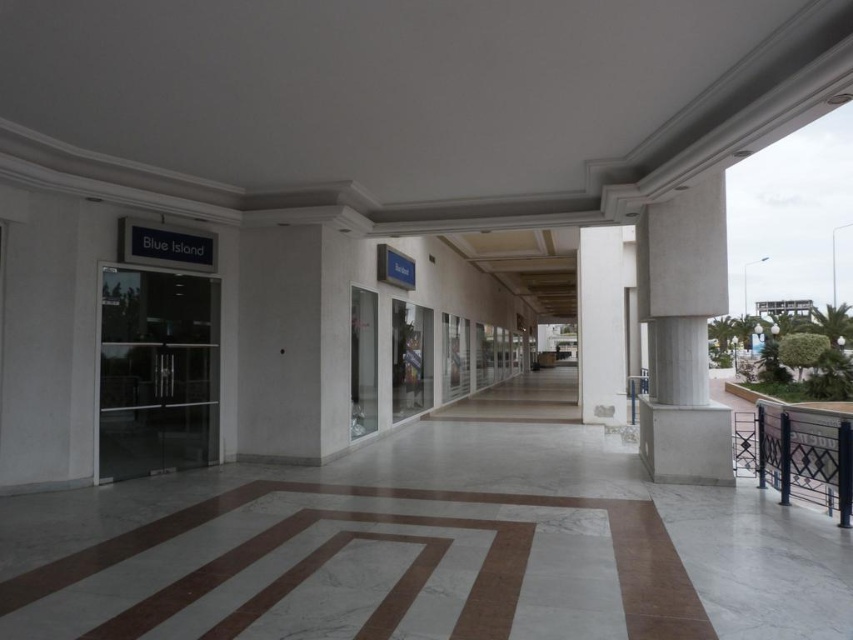
Who is more distant from viewer, (595, 376) or (776, 467)?

The point (595, 376) is more distant.

This screenshot has width=853, height=640. What do you see at coordinates (602, 323) in the screenshot?
I see `white marble pillar at center` at bounding box center [602, 323].

Locate an element on the screen. This screenshot has width=853, height=640. white marble pillar at center is located at coordinates 602,323.

Who is positioned more to the right, white marble pillar at right or white marble pillar at center?

white marble pillar at center

Is the position of white marble pillar at right less distant than that of white marble pillar at center?

Yes, white marble pillar at right is in front of white marble pillar at center.

The width and height of the screenshot is (853, 640). What do you see at coordinates (682, 333) in the screenshot? I see `white marble pillar at right` at bounding box center [682, 333].

Locate an element on the screen. The width and height of the screenshot is (853, 640). white marble pillar at right is located at coordinates (682, 333).

Who is lower down, white marble pillar at right or black metal balustrade at lower right?

black metal balustrade at lower right is below.

Based on the photo, between white marble pillar at right and black metal balustrade at lower right, which one has more height?

white marble pillar at right is taller.

Is point (664, 308) less distant than point (759, 461)?

No, (664, 308) is further to viewer.

Image resolution: width=853 pixels, height=640 pixels. I want to click on white marble pillar at right, so click(x=682, y=333).